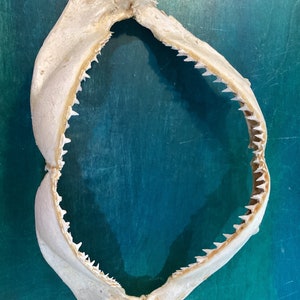
At what (x,y) coordinates should I click in order to perform the action: click on wall. Please return your answer as a coordinate pair (x, y). This screenshot has height=300, width=300. Looking at the image, I should click on (184, 198).